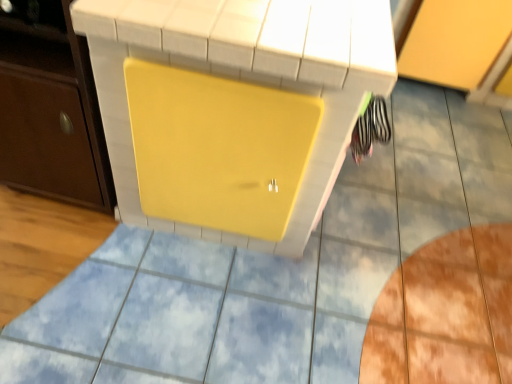
Question: Should I look upward or downward to see matte brown cabinet at left, placed as the 2th cabinetry when sorted from back to front?

Choices:
 (A) down
 (B) up

Answer: (B)

Question: Is yellow matte vanity at center outside yellow matte cabinet at upper right, which ranks as the first cabinetry in back-to-front order?

Choices:
 (A) yes
 (B) no

Answer: (A)

Question: Is yellow matte vanity at center to the right of yellow matte cabinet at upper right, placed as the first cabinetry when sorted from right to left, from the viewer's perspective?

Choices:
 (A) no
 (B) yes

Answer: (A)

Question: Is there a large distance between yellow matte vanity at center and yellow matte cabinet at upper right, which is the 2th cabinetry in front-to-back order?

Choices:
 (A) yes
 (B) no

Answer: (A)

Question: Is yellow matte vanity at center shorter than yellow matte cabinet at upper right, which is the 2th cabinetry in front-to-back order?

Choices:
 (A) yes
 (B) no

Answer: (B)

Question: Considering the relative sizes of yellow matte vanity at center and yellow matte cabinet at upper right, placed as the first cabinetry when sorted from right to left, in the image provided, is yellow matte vanity at center thinner than yellow matte cabinet at upper right, placed as the first cabinetry when sorted from right to left,?

Choices:
 (A) no
 (B) yes

Answer: (B)

Question: From a real-world perspective, is yellow matte vanity at center located higher than yellow matte cabinet at upper right, which is the 2th cabinetry in front-to-back order?

Choices:
 (A) yes
 (B) no

Answer: (A)

Question: Is yellow matte cabinet at upper right, which is the 2th cabinetry in front-to-back order, not inside matte brown cabinet at left, the first cabinetry when ordered from left to right?

Choices:
 (A) yes
 (B) no

Answer: (A)

Question: From the image's perspective, is yellow matte cabinet at upper right, the second cabinetry from the left, above matte brown cabinet at left, marked as the second cabinetry in a right-to-left arrangement?

Choices:
 (A) yes
 (B) no

Answer: (A)

Question: From a real-world perspective, is yellow matte cabinet at upper right, which is the 2th cabinetry in front-to-back order, positioned under matte brown cabinet at left, marked as the second cabinetry in a right-to-left arrangement, based on gravity?

Choices:
 (A) no
 (B) yes

Answer: (B)

Question: From a real-world perspective, is yellow matte cabinet at upper right, which is the 2th cabinetry in front-to-back order, located higher than matte brown cabinet at left, placed as the 2th cabinetry when sorted from back to front?

Choices:
 (A) yes
 (B) no

Answer: (B)

Question: Does yellow matte cabinet at upper right, which is the 2th cabinetry in front-to-back order, lie behind matte brown cabinet at left, the first cabinetry when ordered from left to right?

Choices:
 (A) yes
 (B) no

Answer: (A)

Question: Is matte brown cabinet at left, marked as the second cabinetry in a right-to-left arrangement, a part of yellow matte cabinet at upper right, which is the 2th cabinetry in front-to-back order?

Choices:
 (A) no
 (B) yes

Answer: (A)

Question: Is matte brown cabinet at left, the 1th cabinetry positioned from the front, oriented away from yellow matte cabinet at upper right, the second cabinetry from the left?

Choices:
 (A) no
 (B) yes

Answer: (A)